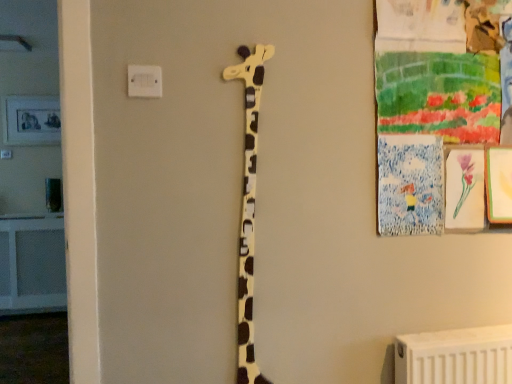
What do you see at coordinates (248, 207) in the screenshot?
I see `matte yellow giraffe at center` at bounding box center [248, 207].

The height and width of the screenshot is (384, 512). What are the coordinates of `matte yellow giraffe at center` in the screenshot? It's located at (248, 207).

Locate an element on the screen. white plastic electric outlet at upper center is located at coordinates (144, 81).

This screenshot has height=384, width=512. What do you see at coordinates (144, 81) in the screenshot?
I see `white plastic electric outlet at upper center` at bounding box center [144, 81].

Locate an element on the screen. The height and width of the screenshot is (384, 512). matte yellow giraffe at center is located at coordinates (248, 207).

Looking at this image, visually, is matte yellow giraffe at center positioned to the left or to the right of white plastic electric outlet at upper center?

matte yellow giraffe at center is to the right of white plastic electric outlet at upper center.

Which object is closer to the camera, matte yellow giraffe at center or white plastic electric outlet at upper center?

white plastic electric outlet at upper center is in front.

Does point (244, 76) appear closer or farther from the camera than point (142, 75)?

Point (244, 76) is farther from the camera than point (142, 75).

From the image's perspective, between matte yellow giraffe at center and white plastic electric outlet at upper center, who is located below?

matte yellow giraffe at center appears lower in the image.

From a real-world perspective, is matte yellow giraffe at center under white plastic electric outlet at upper center?

Yes, from a real-world perspective, matte yellow giraffe at center is under white plastic electric outlet at upper center.

Does matte yellow giraffe at center have a lesser width compared to white plastic electric outlet at upper center?

No.

In terms of height, does matte yellow giraffe at center look taller or shorter compared to white plastic electric outlet at upper center?

In the image, matte yellow giraffe at center appears to be taller than white plastic electric outlet at upper center.

Can you confirm if matte yellow giraffe at center is bigger than white plastic electric outlet at upper center?

Yes, matte yellow giraffe at center is bigger than white plastic electric outlet at upper center.

Can we say matte yellow giraffe at center lies outside white plastic electric outlet at upper center?

matte yellow giraffe at center lies outside white plastic electric outlet at upper center's area.

From the picture: Is matte yellow giraffe at center with white plastic electric outlet at upper center?

matte yellow giraffe at center and white plastic electric outlet at upper center are clearly separated.

Is matte yellow giraffe at center turned away from white plastic electric outlet at upper center?

No, white plastic electric outlet at upper center is not at the back of matte yellow giraffe at center.

Can you tell me how much matte yellow giraffe at center and white plastic electric outlet at upper center differ in facing direction?

The facing directions of matte yellow giraffe at center and white plastic electric outlet at upper center are 1.2 degrees apart.

Where is `giraffe located on the right of white plastic electric outlet at upper center`? The image size is (512, 384). giraffe located on the right of white plastic electric outlet at upper center is located at coordinates (248, 207).

Which is more to the left, white plastic electric outlet at upper center or matte yellow giraffe at center?

white plastic electric outlet at upper center.

Who is more distant, white plastic electric outlet at upper center or matte yellow giraffe at center?

matte yellow giraffe at center is further away from the camera.

Is point (154, 73) less distant than point (239, 68)?

That is True.

From the image's perspective, does white plastic electric outlet at upper center appear higher than matte yellow giraffe at center?

Yes.

From a real-world perspective, is white plastic electric outlet at upper center on top of matte yellow giraffe at center?

Yes, from a real-world perspective, white plastic electric outlet at upper center is above matte yellow giraffe at center.

Does white plastic electric outlet at upper center have a lesser width compared to matte yellow giraffe at center?

Indeed, white plastic electric outlet at upper center has a lesser width compared to matte yellow giraffe at center.

Considering the sizes of objects white plastic electric outlet at upper center and matte yellow giraffe at center in the image provided, who is shorter, white plastic electric outlet at upper center or matte yellow giraffe at center?

With less height is white plastic electric outlet at upper center.

Does white plastic electric outlet at upper center have a larger size compared to matte yellow giraffe at center?

Incorrect, white plastic electric outlet at upper center is not larger than matte yellow giraffe at center.

Is white plastic electric outlet at upper center inside the boundaries of matte yellow giraffe at center, or outside?

white plastic electric outlet at upper center cannot be found inside matte yellow giraffe at center.

Is white plastic electric outlet at upper center next to matte yellow giraffe at center?

No.

Is white plastic electric outlet at upper center aimed at matte yellow giraffe at center?

No.

Can you tell me how much white plastic electric outlet at upper center and matte yellow giraffe at center differ in facing direction?

There is a 1.2-degree angle between the facing directions of white plastic electric outlet at upper center and matte yellow giraffe at center.

How much distance is there between white plastic electric outlet at upper center and matte yellow giraffe at center?

A distance of 35.42 centimeters exists between white plastic electric outlet at upper center and matte yellow giraffe at center.

This screenshot has width=512, height=384. Identify the location of electric outlet in front of the matte yellow giraffe at center. (144, 81).

At what (x,y) coordinates should I click in order to perform the action: click on electric outlet above the matte yellow giraffe at center (from a real-world perspective). Please return your answer as a coordinate pair (x, y). Looking at the image, I should click on (144, 81).

Locate an element on the screen. giraffe that appears behind the white plastic electric outlet at upper center is located at coordinates (248, 207).